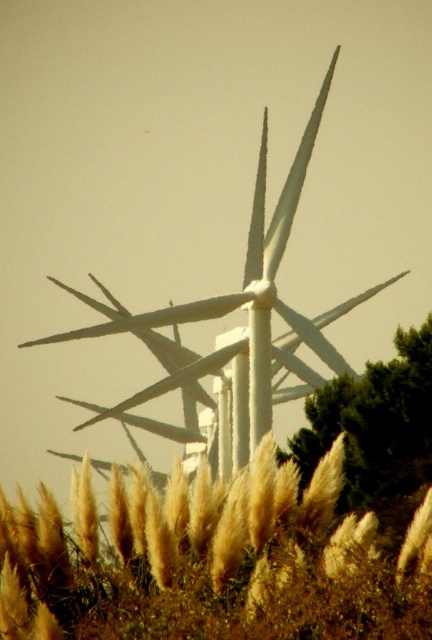
Question: Which object appears farthest from the camera in this image?

Choices:
 (A) white matte windmill at center
 (B) golden textured grass at lower center

Answer: (A)

Question: Considering the relative positions of golden textured grass at lower center and white matte windmill at center in the image provided, where is golden textured grass at lower center located with respect to white matte windmill at center?

Choices:
 (A) right
 (B) left

Answer: (A)

Question: Does golden textured grass at lower center have a lesser width compared to white matte windmill at center?

Choices:
 (A) no
 (B) yes

Answer: (B)

Question: Observing the image, what is the correct spatial positioning of golden textured grass at lower center in reference to white matte windmill at center?

Choices:
 (A) left
 (B) right

Answer: (B)